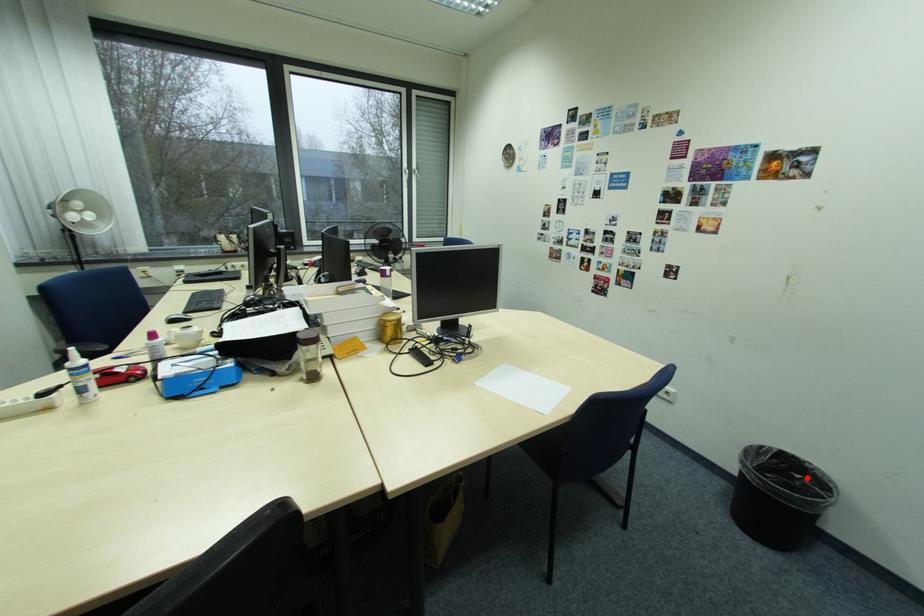
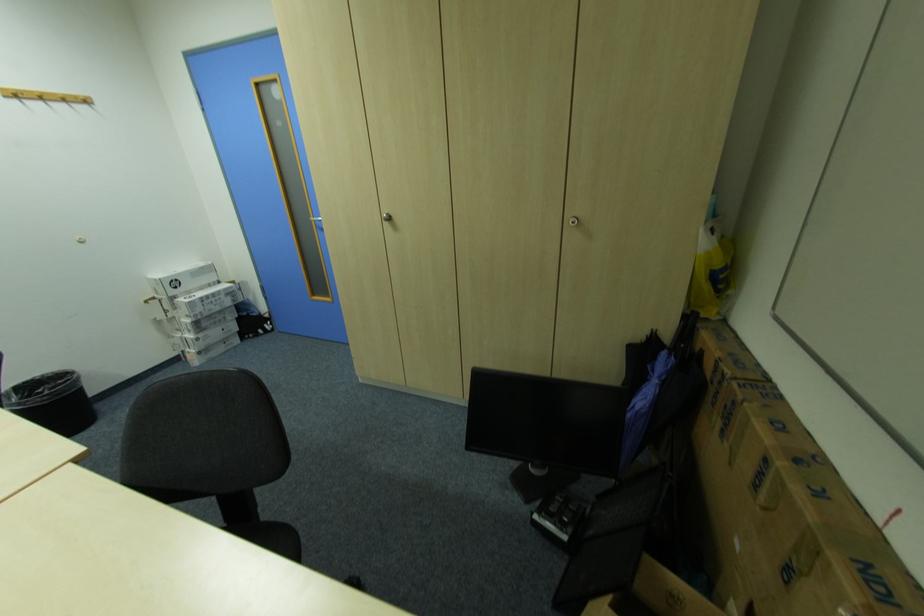
In the second image, find the point that corresponds to the highlighted location in the first image.

(49, 391)